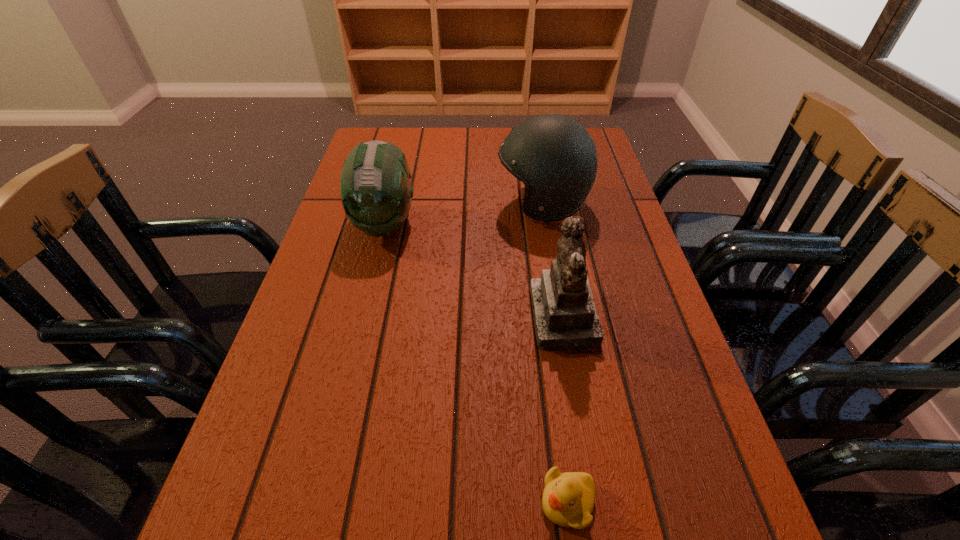
What are the coordinates of `vacant space that satisfies the following two spatial constraints: 1. at the face opening of the right football helmet; 2. on the visor of the shorter football helmet` in the screenshot? It's located at (546, 224).

Identify the location of free space that satisfies the following two spatial constraints: 1. at the face opening of the right football helmet; 2. on the visor of the left football helmet. (546, 224).

The width and height of the screenshot is (960, 540). I want to click on vacant region that satisfies the following two spatial constraints: 1. at the face opening of the right football helmet; 2. on the visor of the left football helmet, so click(x=546, y=224).

Where is `free space that satisfies the following two spatial constraints: 1. at the face opening of the right football helmet; 2. on the visor of the leftmost object`? free space that satisfies the following two spatial constraints: 1. at the face opening of the right football helmet; 2. on the visor of the leftmost object is located at coordinates (546, 224).

The height and width of the screenshot is (540, 960). I want to click on free space in the image that satisfies the following two spatial constraints: 1. at the face opening of the right football helmet; 2. on the visor of the shorter football helmet, so click(x=546, y=224).